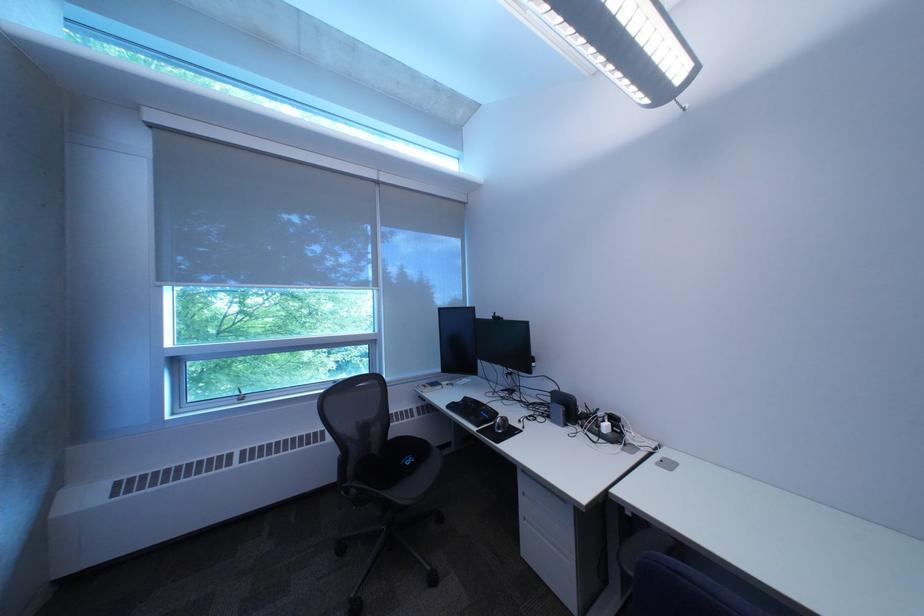
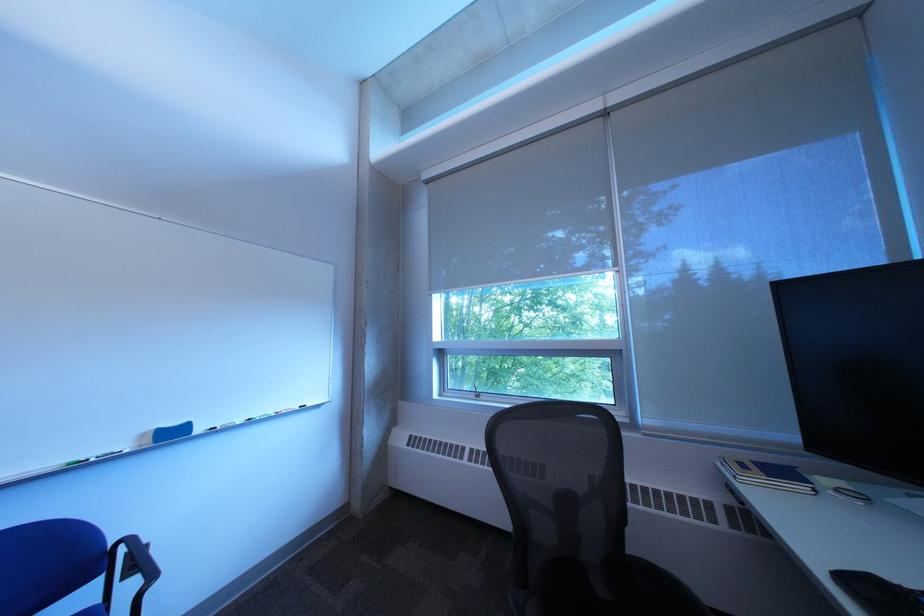
Where in the second image is the point corresponding to point 345,261 from the first image?

(611, 267)